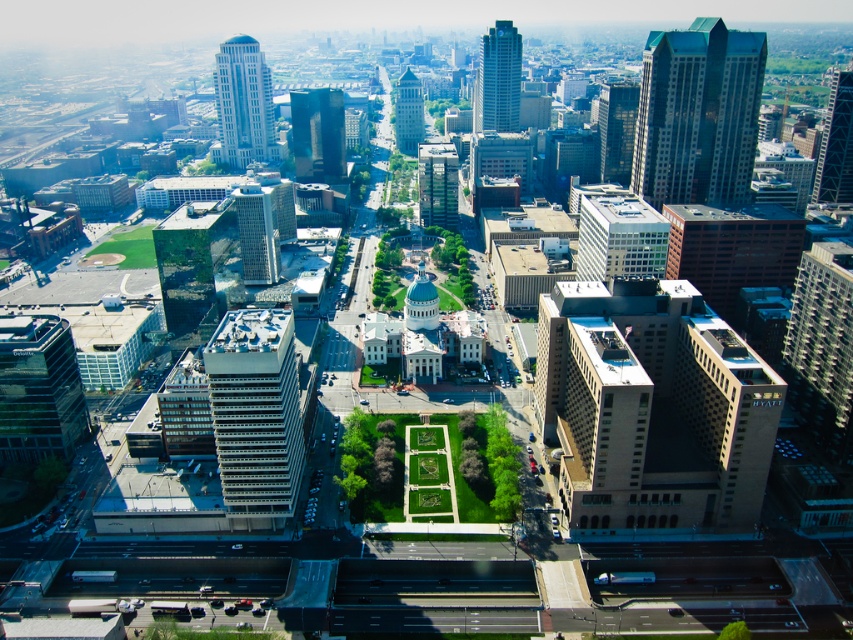
Is beige concrete building at center-right in front of shiny glass skyscraper at upper left?

That is True.

Image resolution: width=853 pixels, height=640 pixels. What do you see at coordinates (653, 406) in the screenshot?
I see `beige concrete building at center-right` at bounding box center [653, 406].

Between point (704, 499) and point (242, 40), which one is positioned behind?

Positioned behind is point (242, 40).

Identify the location of beige concrete building at center-right. (653, 406).

Is white glass building at center-right above shiny glass skyscraper at upper left?

No.

How far apart are white glass building at center-right and shiny glass skyscraper at upper left?

white glass building at center-right is 961.29 feet away from shiny glass skyscraper at upper left.

Between point (648, 252) and point (234, 42), which one is positioned behind?

Point (234, 42)

I want to click on white glass building at center-right, so click(x=619, y=237).

How distant is white glass building at center from glassy reflective skyscraper at center?

A distance of 322.72 meters exists between white glass building at center and glassy reflective skyscraper at center.

Is white glass building at center to the left of glassy reflective skyscraper at center from the viewer's perspective?

No, white glass building at center is not to the left of glassy reflective skyscraper at center.

In the scene shown: Who is more distant from viewer, (274, 384) or (310, 129)?

Positioned behind is point (310, 129).

This screenshot has width=853, height=640. I want to click on white glass building at center, so click(256, 412).